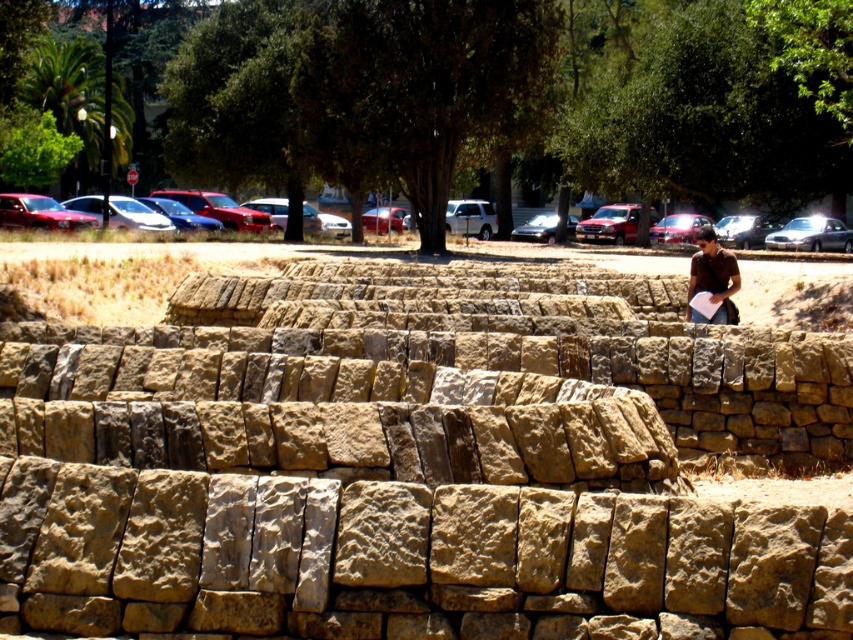
Question: In this image, where is natural stone wall at center located relative to brown shirt at upper right?

Choices:
 (A) above
 (B) below

Answer: (B)

Question: Which object appears closest to the camera in this image?

Choices:
 (A) natural stone wall at center
 (B) brown shirt at upper right

Answer: (A)

Question: Is natural stone wall at center smaller than brown shirt at upper right?

Choices:
 (A) yes
 (B) no

Answer: (A)

Question: Which point is farther to the camera?

Choices:
 (A) natural stone wall at center
 (B) brown shirt at upper right

Answer: (B)

Question: Does natural stone wall at center appear on the left side of brown shirt at upper right?

Choices:
 (A) yes
 (B) no

Answer: (A)